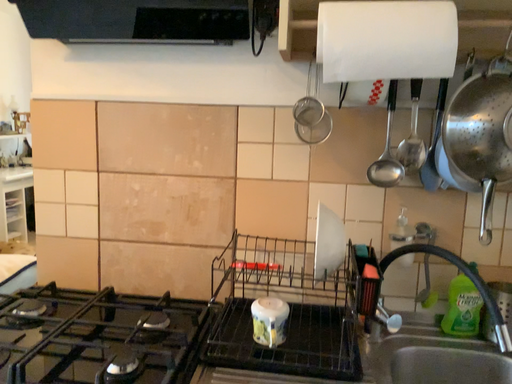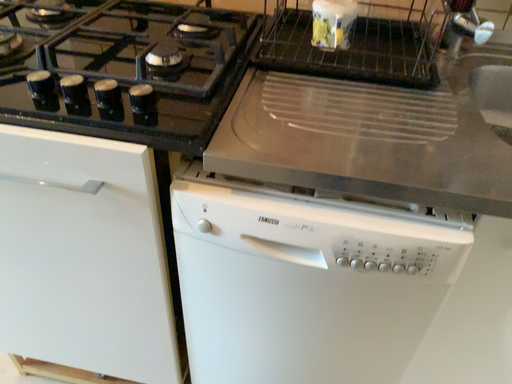
Question: How did the camera likely rotate when shooting the video?

Choices:
 (A) rotated downward
 (B) rotated upward

Answer: (A)